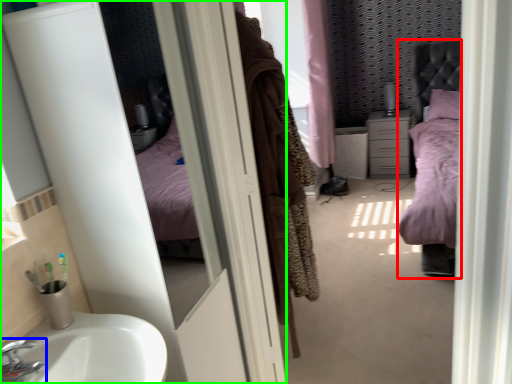
Question: Which object is positioned farthest from bed (highlighted by a red box)? Select from tap (highlighted by a blue box) and screen door (highlighted by a green box).

Choices:
 (A) tap
 (B) screen door

Answer: (A)